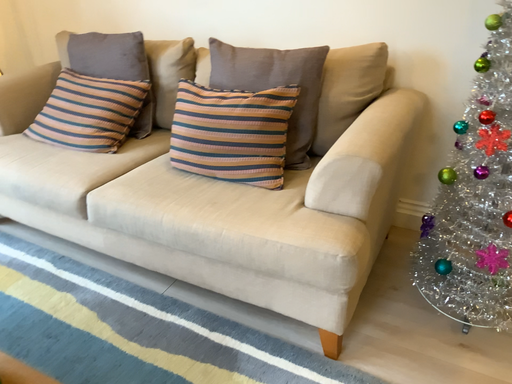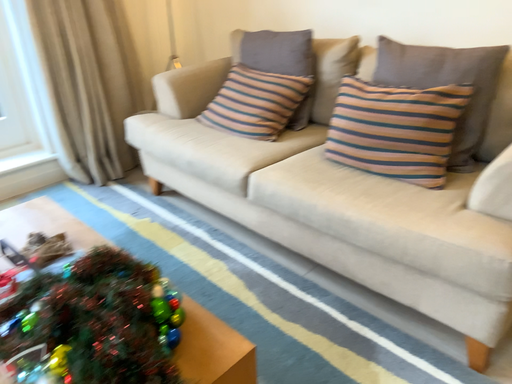
Question: Which way did the camera rotate in the video?

Choices:
 (A) rotated left
 (B) rotated right

Answer: (A)